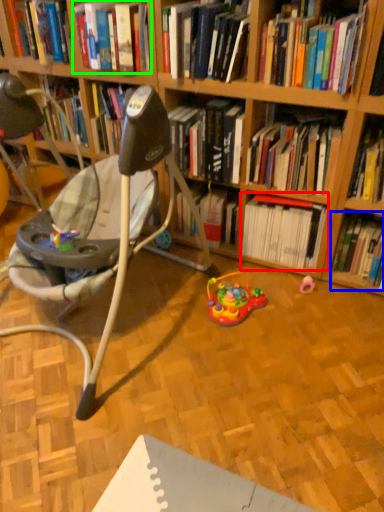
Question: Considering the real-world distances, which object is farthest from book (highlighted by a red box)? book (highlighted by a blue box) or book (highlighted by a green box)?

Choices:
 (A) book
 (B) book

Answer: (B)